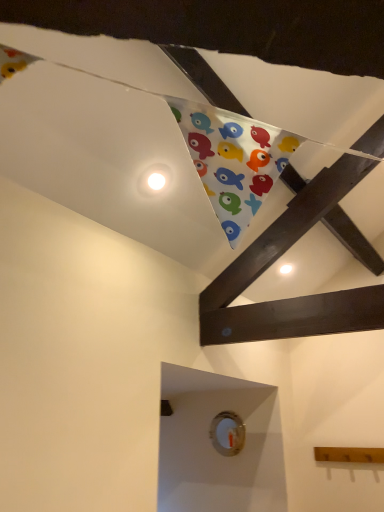
Question: Should I look upward or downward to see white matte button at upper center, which is counted as the 1th button, starting from the front?

Choices:
 (A) down
 (B) up

Answer: (B)

Question: Does white plastic button at lower center, which is counted as the first button, starting from the bottom, have a smaller size compared to white matte button at upper center, placed as the first button when sorted from left to right?

Choices:
 (A) yes
 (B) no

Answer: (B)

Question: From the image's perspective, is white plastic button at lower center, positioned as the 1th button in right-to-left order, located beneath white matte button at upper center, the first button viewed from the top?

Choices:
 (A) no
 (B) yes

Answer: (B)

Question: Could you tell me if white plastic button at lower center, arranged as the second button when viewed from the front, is facing white matte button at upper center, the second button from the bottom?

Choices:
 (A) yes
 (B) no

Answer: (B)

Question: Is white plastic button at lower center, positioned as the 1th button in right-to-left order, in front of white matte button at upper center, placed as the 2th button when sorted from back to front?

Choices:
 (A) yes
 (B) no

Answer: (B)

Question: Does white plastic button at lower center, positioned as the 1th button in right-to-left order, have a greater width compared to white matte button at upper center, placed as the 2th button when sorted from back to front?

Choices:
 (A) yes
 (B) no

Answer: (B)

Question: From the image's perspective, is white plastic button at lower center, arranged as the second button when viewed from the front, on top of white matte button at upper center, placed as the first button when sorted from left to right?

Choices:
 (A) no
 (B) yes

Answer: (A)

Question: Is white matte button at upper center, placed as the 2th button when sorted from back to front, in contact with white plastic button at lower center, positioned as the 1th button in right-to-left order?

Choices:
 (A) yes
 (B) no

Answer: (B)

Question: From the image's perspective, is white matte button at upper center, placed as the first button when sorted from left to right, on white plastic button at lower center, arranged as the second button when viewed from the front?

Choices:
 (A) yes
 (B) no

Answer: (A)

Question: Does white matte button at upper center, which is counted as the 1th button, starting from the front, have a smaller size compared to white plastic button at lower center, acting as the second button starting from the top?

Choices:
 (A) yes
 (B) no

Answer: (A)

Question: Is white matte button at upper center, which is the second button in right-to-left order, turned away from white plastic button at lower center, the 1th button in the back-to-front sequence?

Choices:
 (A) no
 (B) yes

Answer: (A)

Question: Is the position of white matte button at upper center, which is the second button in right-to-left order, more distant than that of white plastic button at lower center, acting as the second button starting from the top?

Choices:
 (A) yes
 (B) no

Answer: (B)

Question: Is white matte button at upper center, placed as the 2th button when sorted from back to front, shorter than white plastic button at lower center, positioned as the 1th button in right-to-left order?

Choices:
 (A) yes
 (B) no

Answer: (A)

Question: In the image, is white matte button at upper center, which is the second button in right-to-left order, positioned in front of or behind white plastic button at lower center, which is the second button from left to right?

Choices:
 (A) behind
 (B) front

Answer: (B)